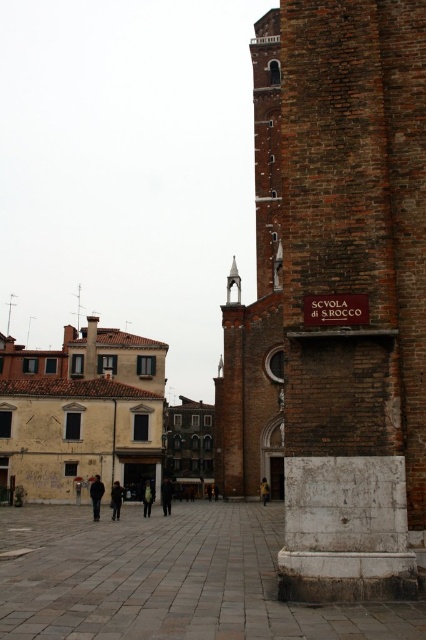
Question: Is dark brown leather coat at center to the left of dark gray fabric coat at center from the viewer's perspective?

Choices:
 (A) yes
 (B) no

Answer: (A)

Question: Which object is positioned closest to the yellow fabric at center?

Choices:
 (A) dark gray jacket at lower left
 (B) dark gray fabric coat at center
 (C) green fabric jacket at center

Answer: (B)

Question: Does brown brick bell tower at upper right appear over yellow fabric at center?

Choices:
 (A) no
 (B) yes

Answer: (B)

Question: Considering the relative positions of dark gray fabric coat at center and green fabric jacket at center in the image provided, where is dark gray fabric coat at center located with respect to green fabric jacket at center?

Choices:
 (A) above
 (B) below

Answer: (B)

Question: Which of the following is the closest to the observer?

Choices:
 (A) dark gray jacket at lower left
 (B) yellow fabric at center

Answer: (A)

Question: Estimate the real-world distances between objects in this image. Which object is farther from the green fabric jacket at center?

Choices:
 (A) dark gray fabric coat at center
 (B) yellow fabric at center
 (C) dark gray jacket at lower left
 (D) dark brown leather coat at center

Answer: (B)